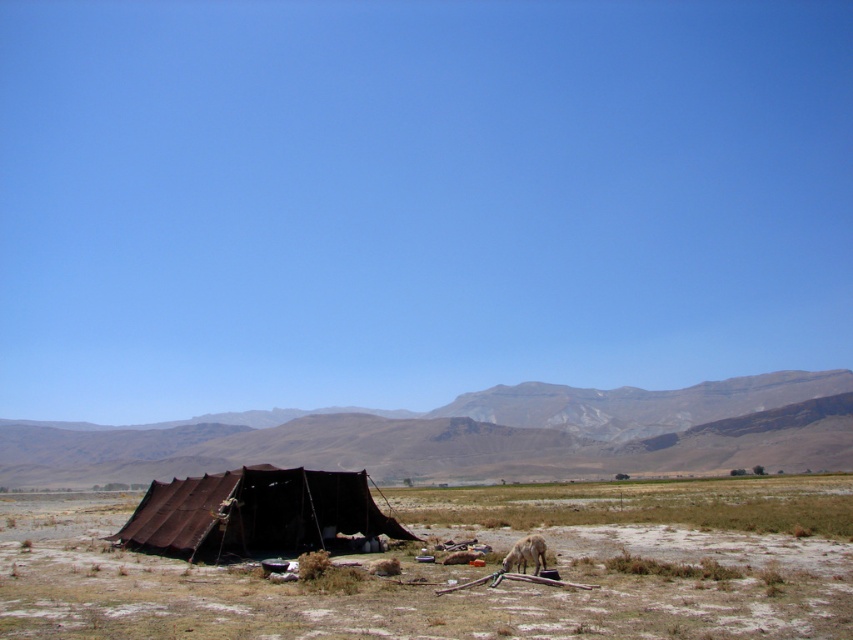
You are planning to set up a new tent in this campsite. You have a tent that is 3 meters wide. The brown fabric tent at lower left and the brown canvas tent at center are already there. Can your new tent fit between them if placed in the space between them?

The brown fabric tent at lower left is wider than the brown canvas tent at center. However, without knowing the exact distance between them, it is impossible to determine if your 3 meter wide tent will fit.

You are standing at the point with coordinates point (320, 452) and want to walk to the point with coordinates point (518, 560). Given that there is a tent between you and the destination, will you be able to see the destination point while walking towards it?

Since point (320, 452) is behind point (518, 560), you will not be able to see the destination point while walking towards it because the tent is blocking your view.

You are planning to set up a new tent in this area. The brown fabric tent at lower left is 11.03 meters away from the brown canvas tent at center. If your new tent requires at least 10 meters of space between it and any existing tents for safety, can you place it between the two existing tents?

The distance between the brown fabric tent at lower left and the brown canvas tent at center is 11.03 meters. Since the required safety distance is at least 10 meters, placing a new tent between them would violate the safety requirement because the existing tents are already spaced adequately, but inserting another tent would reduce the distance below the required 10 meters between adjacent tents.